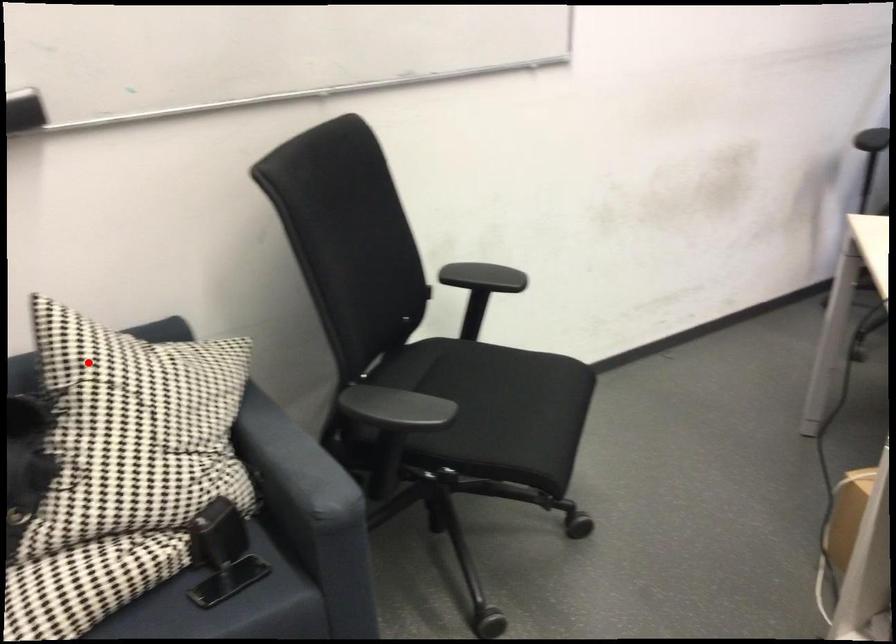
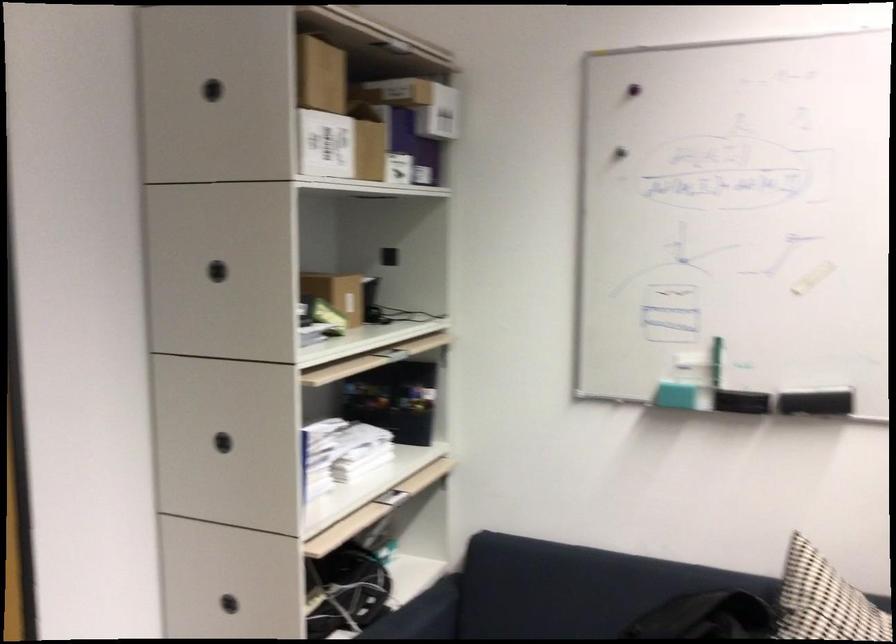
Question: I am providing you with two images of the same scene from different viewpoints. In image1, a red point is highlighted. Considering the same 3D point in image2, which of the following is correct?

Choices:
 (A) It is closer
 (B) It is farther

Answer: (B)